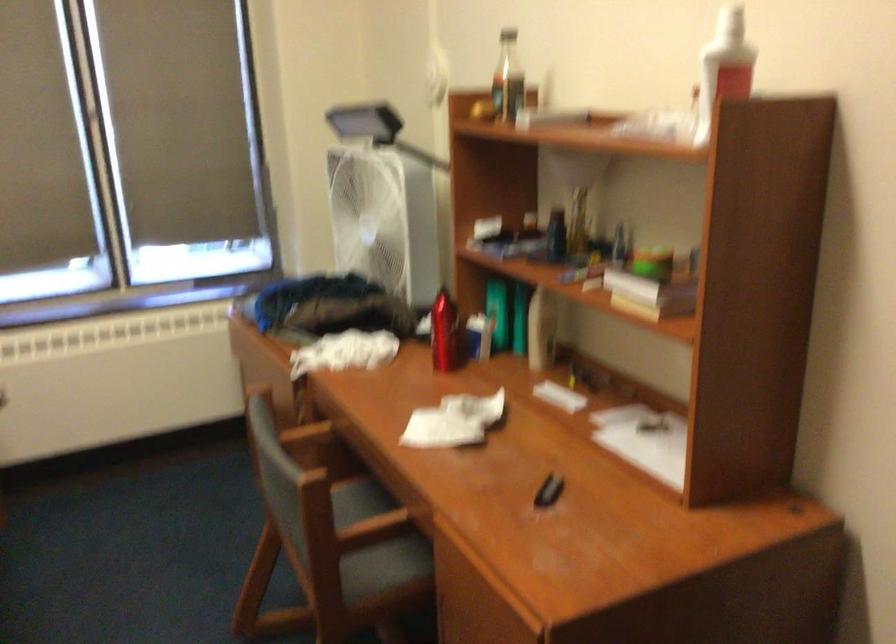
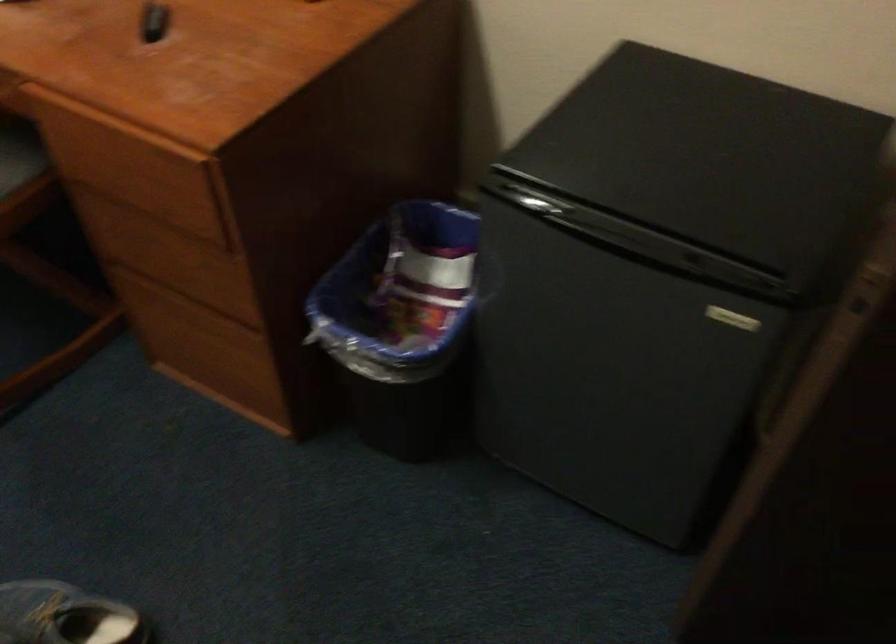
First-person continuous shooting, in which direction is the camera rotating?

The camera rotated toward right-down.